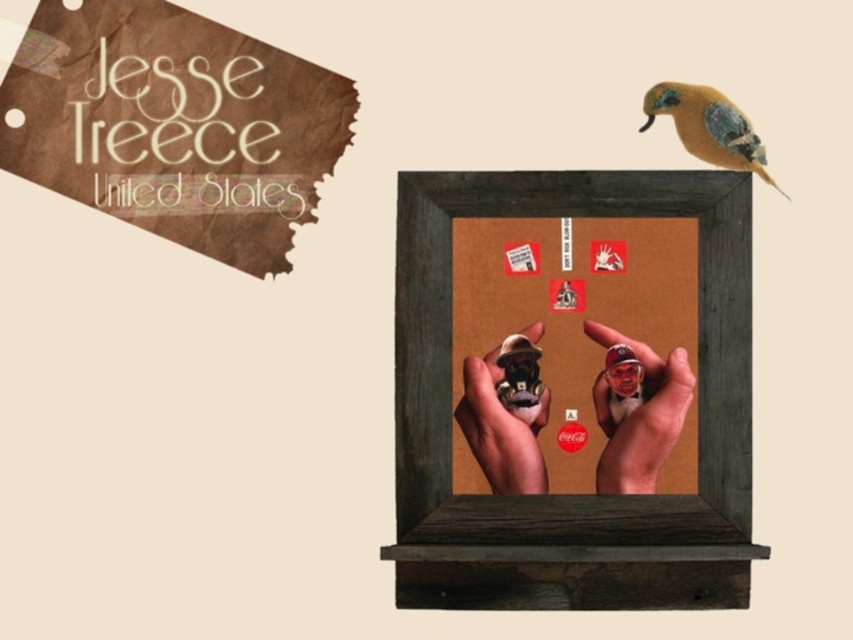
Question: Can you confirm if smooth plastic hand at center is positioned below orange feathered bird at upper right?

Choices:
 (A) yes
 (B) no

Answer: (A)

Question: Is matte brown figurine at center behind orange feathered bird at upper right?

Choices:
 (A) yes
 (B) no

Answer: (B)

Question: Which object is farther from the camera taking this photo?

Choices:
 (A) smooth plastic hand at center
 (B) matte brown figurine at center

Answer: (B)

Question: Is brown wooden picture frame at center wider than smooth plastic hand at center?

Choices:
 (A) yes
 (B) no

Answer: (A)

Question: Which point is closer to the camera taking this photo?

Choices:
 (A) (477, 444)
 (B) (700, 134)
 (C) (653, 410)

Answer: (C)

Question: Which point is closer to the camera?

Choices:
 (A) matte brown figurine at center
 (B) brown wooden picture frame at center

Answer: (B)